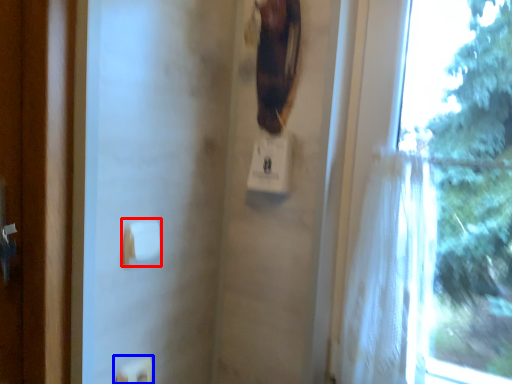
Question: Which of the following is the closest to the observer, towel bar (highlighted by a red box) or light switch (highlighted by a blue box)?

Choices:
 (A) towel bar
 (B) light switch

Answer: (A)